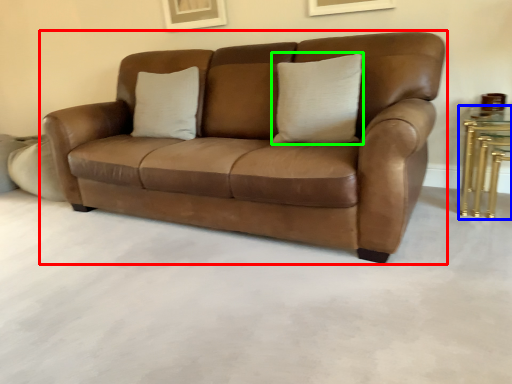
Question: Which is nearer to the studio couch (highlighted by a red box)? table (highlighted by a blue box) or pillow (highlighted by a green box).

Choices:
 (A) table
 (B) pillow

Answer: (B)